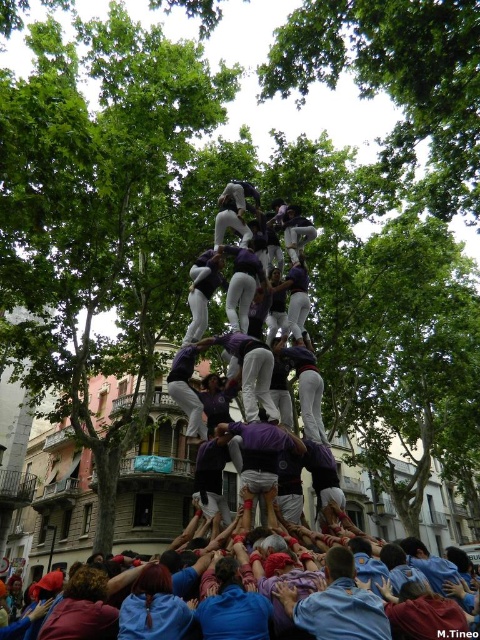
Question: Which point is farther from the camera taking this photo?

Choices:
 (A) (373, 32)
 (B) (313, 616)

Answer: (A)

Question: Which object is farther from the camera taking this photo?

Choices:
 (A) green leafy tree at upper center
 (B) blue fabric crowd at lower center
 (C) blue cotton shirt at lower center

Answer: (A)

Question: Which of the following is the closest to the observer?

Choices:
 (A) blue cotton shirt at lower center
 (B) blue fabric crowd at lower center

Answer: (A)

Question: Observing the image, what is the correct spatial positioning of green leafy tree at upper center in reference to blue fabric crowd at lower center?

Choices:
 (A) above
 (B) below

Answer: (A)

Question: Is blue cotton shirt at lower center bigger than blue fabric crowd at lower center?

Choices:
 (A) yes
 (B) no

Answer: (B)

Question: Is green leafy tree at upper center positioned at the back of blue cotton shirt at lower center?

Choices:
 (A) no
 (B) yes

Answer: (B)